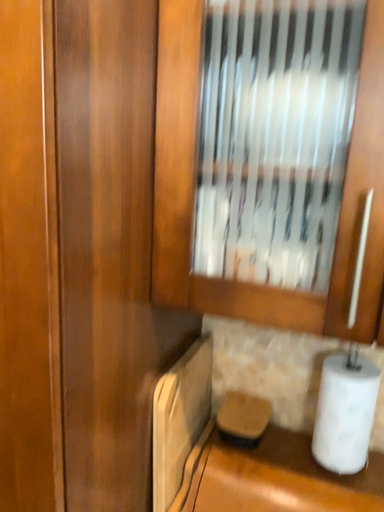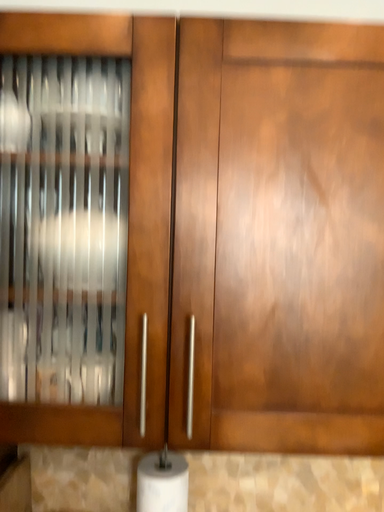
Question: How did the camera likely rotate when shooting the video?

Choices:
 (A) rotated left
 (B) rotated right

Answer: (B)